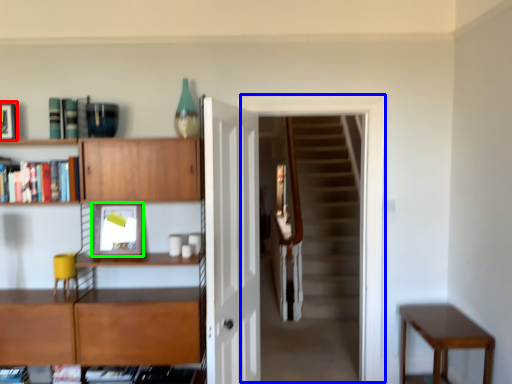
Question: Estimate the real-world distances between objects in this image. Which object is farther from picture frame (highlighted by a red box), passage (highlighted by a blue box) or picture frame (highlighted by a green box)?

Choices:
 (A) passage
 (B) picture frame

Answer: (A)